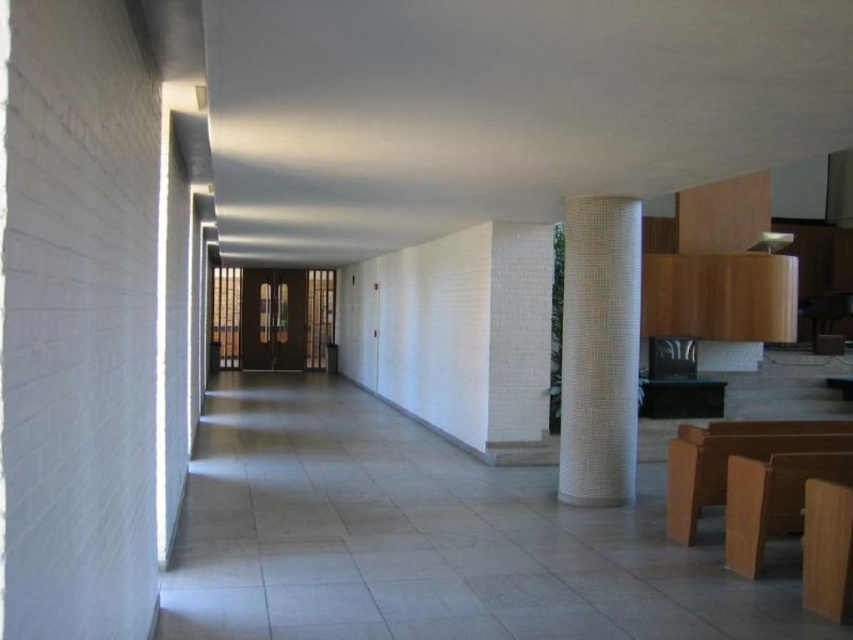
Measure the distance between point (572, 358) and camera.

Point (572, 358) and camera are 6.65 meters apart from each other.

Which is above, white textured pillar at center or light brown wood church bench at lower right?

white textured pillar at center

You are a GUI agent. You are given a task and a screenshot of the screen. Output one action in this format:
    pyautogui.click(x=<x>, y=<y>)
    Task: Click on the white textured pillar at center
    
    Given the screenshot: What is the action you would take?
    pyautogui.click(x=599, y=349)